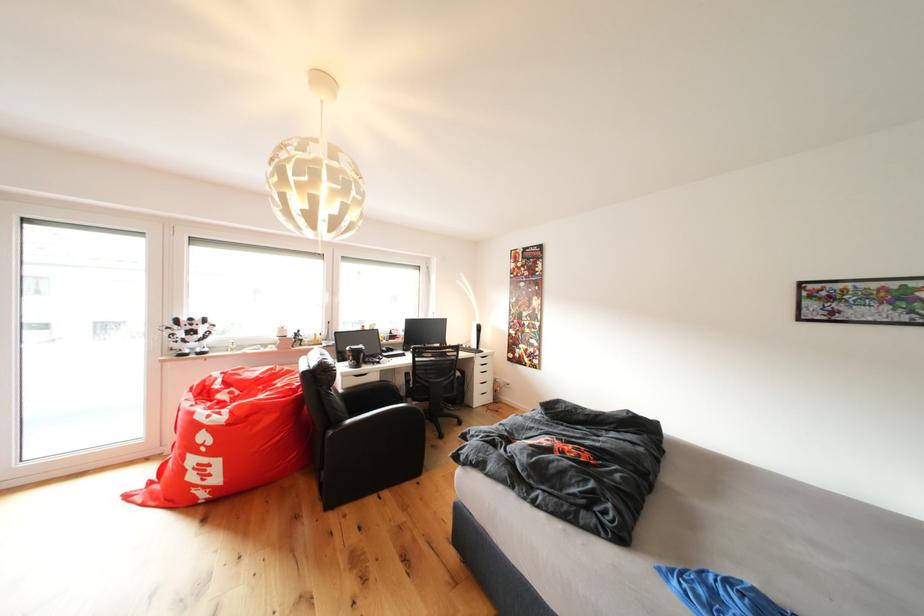
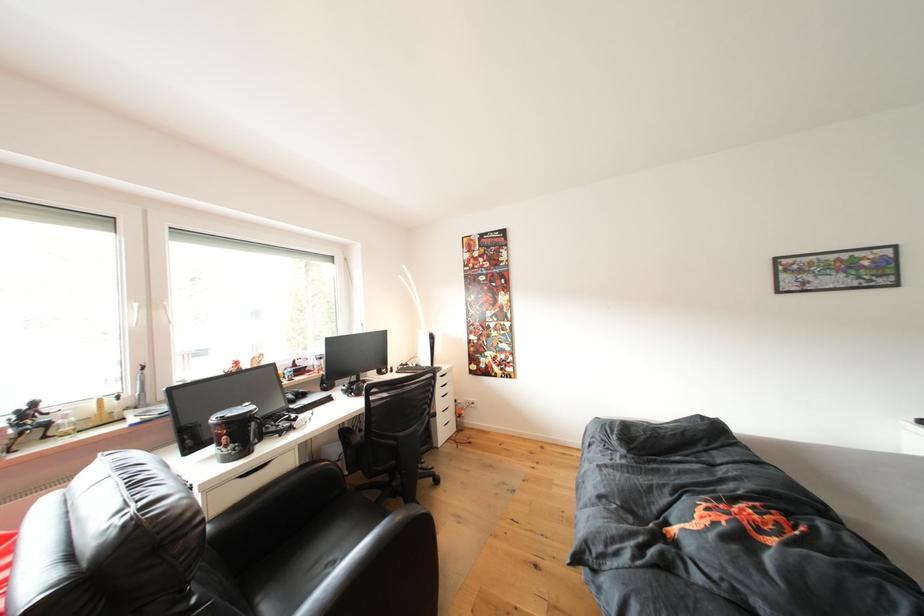
The point at [490,354] is marked in the first image. Where is the corresponding point in the second image?

(444, 370)